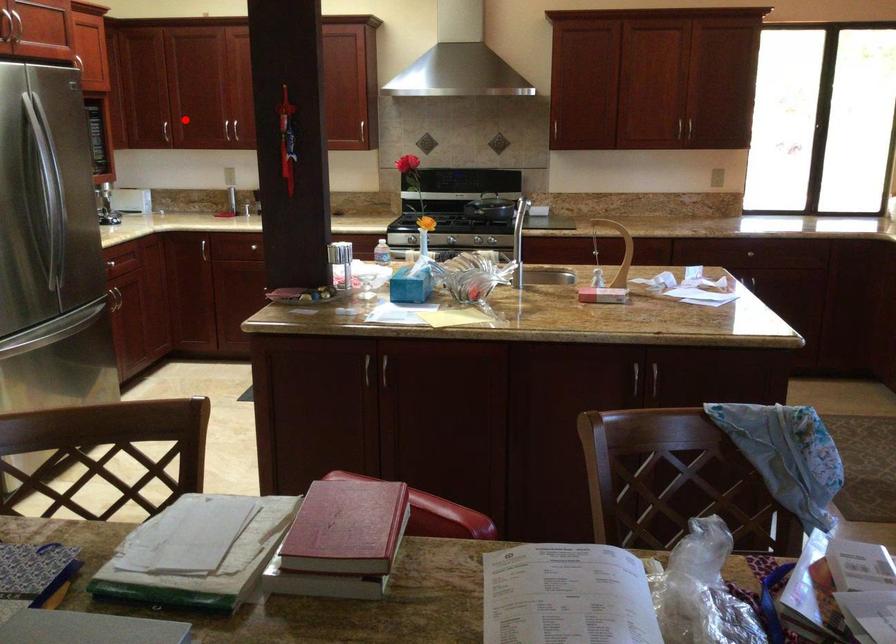
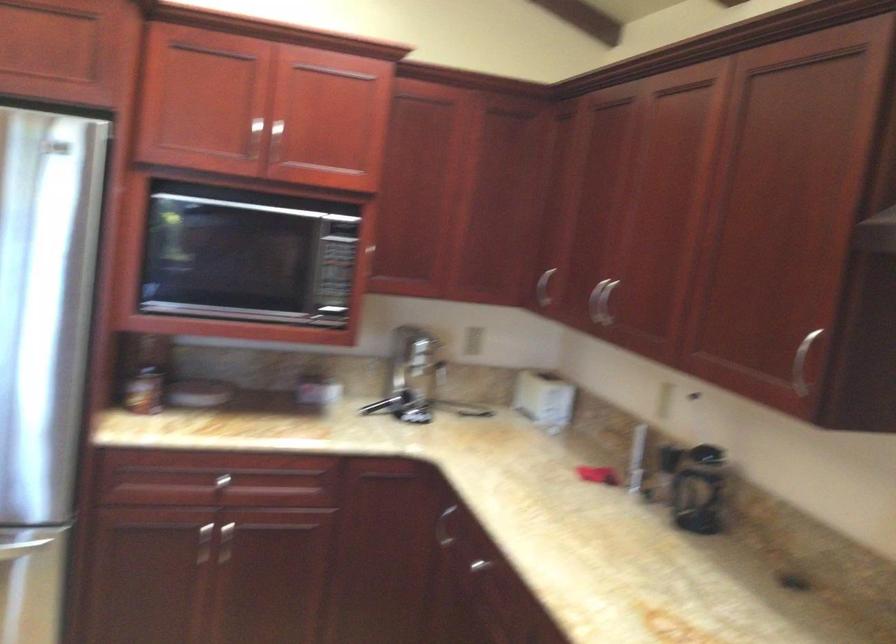
Question: I am providing you with two images of the same scene from different viewpoints. Image1 has a red point marked. In image2, the corresponding 3D location appears at what relative position? Reply with the corresponding letter.

Choices:
 (A) Closer
 (B) Farther

Answer: (A)